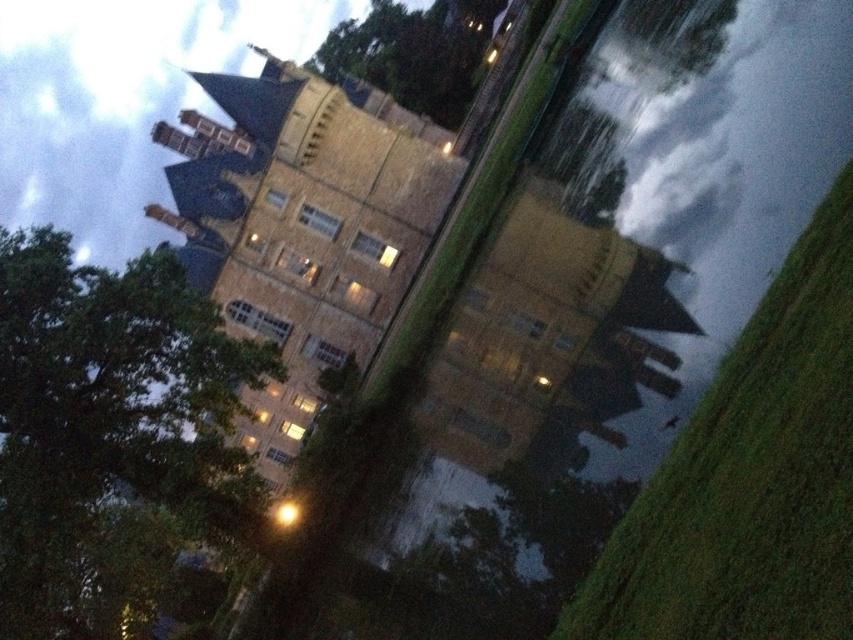
Does green leafy tree at left appear over green leafy tree at upper center?

No, green leafy tree at left is not above green leafy tree at upper center.

Who is lower down, green leafy tree at left or green leafy tree at upper center?

Positioned lower is green leafy tree at left.

Is point (15, 579) closer to camera compared to point (396, 49)?

That is True.

At what (x,y) coordinates should I click in order to perform the action: click on green leafy tree at left. Please return your answer as a coordinate pair (x, y). This screenshot has width=853, height=640. Looking at the image, I should click on (106, 433).